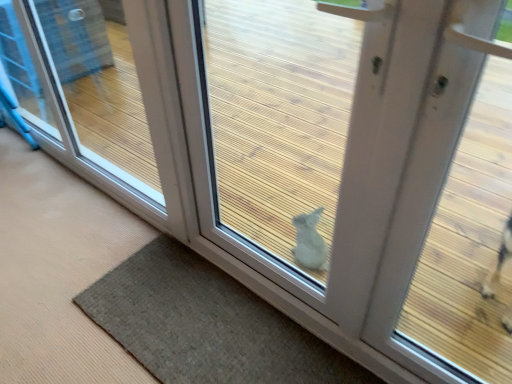
Question: Can you confirm if white matte door at center is taller than brown textured mat at lower center?

Choices:
 (A) no
 (B) yes

Answer: (B)

Question: Is white matte door at center not near brown textured mat at lower center?

Choices:
 (A) no
 (B) yes

Answer: (A)

Question: Can you confirm if white matte door at center is positioned to the left of brown textured mat at lower center?

Choices:
 (A) yes
 (B) no

Answer: (B)

Question: From a real-world perspective, is white matte door at center on brown textured mat at lower center?

Choices:
 (A) no
 (B) yes

Answer: (B)

Question: From the image's perspective, is white matte door at center above brown textured mat at lower center?

Choices:
 (A) yes
 (B) no

Answer: (A)

Question: Is white matte door at center looking in the opposite direction of brown textured mat at lower center?

Choices:
 (A) no
 (B) yes

Answer: (A)

Question: Is brown textured mat at lower center thinner than white matte door at center?

Choices:
 (A) no
 (B) yes

Answer: (A)

Question: Is brown textured mat at lower center at the right side of white matte door at center?

Choices:
 (A) no
 (B) yes

Answer: (A)

Question: Are brown textured mat at lower center and white matte door at center located far from each other?

Choices:
 (A) no
 (B) yes

Answer: (A)

Question: Can you confirm if brown textured mat at lower center is smaller than white matte door at center?

Choices:
 (A) no
 (B) yes

Answer: (B)

Question: Is brown textured mat at lower center oriented away from white matte door at center?

Choices:
 (A) no
 (B) yes

Answer: (A)

Question: Is white matte door at center completely or partially inside brown textured mat at lower center?

Choices:
 (A) no
 (B) yes

Answer: (A)

Question: Considering the relative positions of white matte door at center and transparent glass door at lower right in the image provided, is white matte door at center behind transparent glass door at lower right?

Choices:
 (A) yes
 (B) no

Answer: (B)